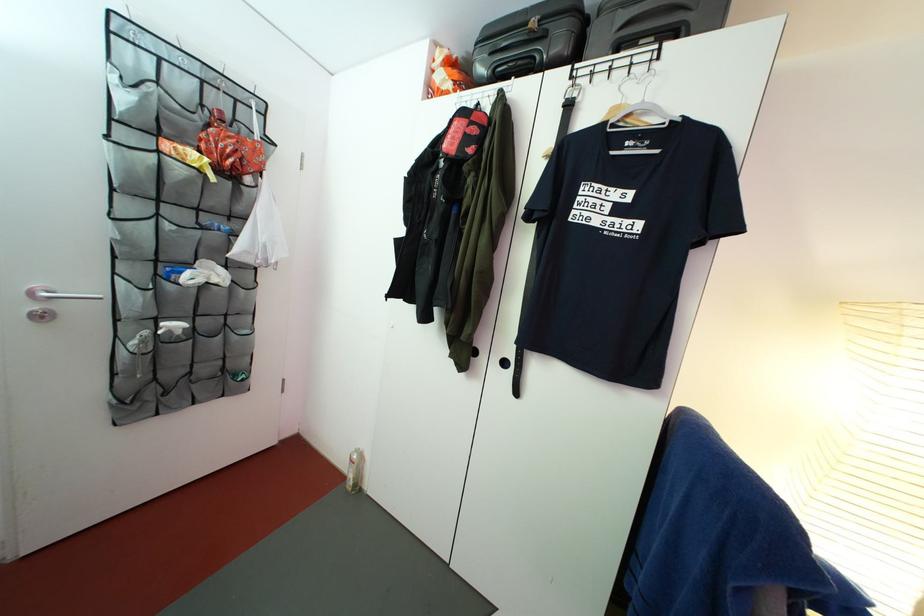
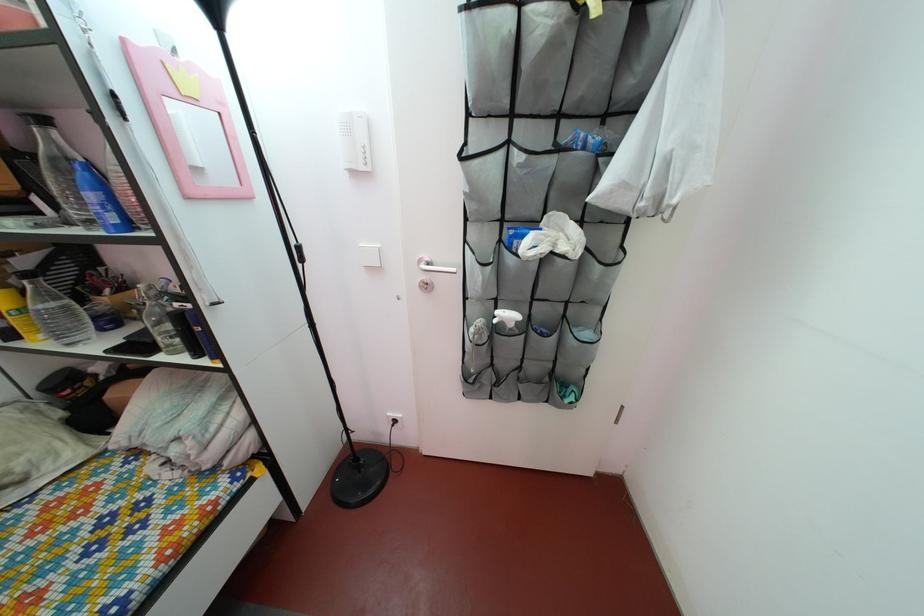
In the second image, find the point that corresponds to (271,248) in the first image.

(675, 152)